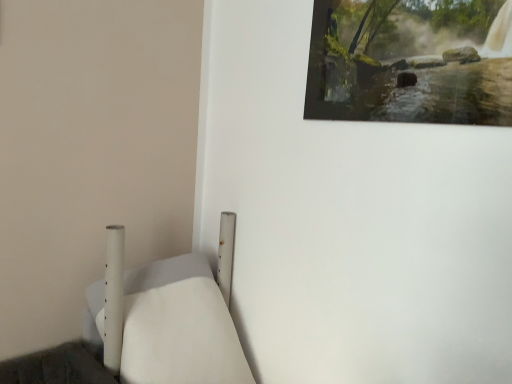
Question: From a real-world perspective, is wooden painting at upper right positioned above or below white matte bed at lower left?

Choices:
 (A) below
 (B) above

Answer: (B)

Question: Relative to white matte bed at lower left, is wooden painting at upper right in front or behind?

Choices:
 (A) front
 (B) behind

Answer: (B)

Question: Visually, is wooden painting at upper right positioned to the left or to the right of white matte bed at lower left?

Choices:
 (A) left
 (B) right

Answer: (B)

Question: Is white matte bed at lower left to the left or to the right of wooden painting at upper right in the image?

Choices:
 (A) left
 (B) right

Answer: (A)

Question: Is white matte bed at lower left wider or thinner than wooden painting at upper right?

Choices:
 (A) thin
 (B) wide

Answer: (B)

Question: Is point (165, 355) closer or farther from the camera than point (455, 23)?

Choices:
 (A) closer
 (B) farther

Answer: (B)

Question: Is white matte bed at lower left spatially inside wooden painting at upper right, or outside of it?

Choices:
 (A) inside
 (B) outside

Answer: (B)